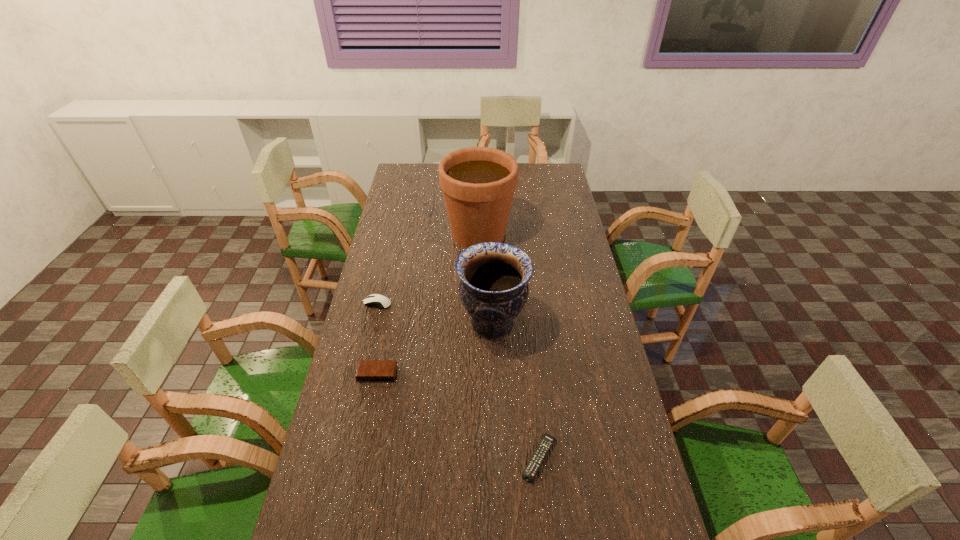
This screenshot has height=540, width=960. In order to click on flowerpot in this screenshot , I will do `click(478, 183)`.

I want to click on the farthest object, so click(478, 183).

Find the location of a particular element. Image resolution: width=960 pixels, height=540 pixels. the second tallest object is located at coordinates (493, 288).

The height and width of the screenshot is (540, 960). Identify the location of the third tallest object. (375, 300).

Where is `the fourth farthest object`? This screenshot has width=960, height=540. the fourth farthest object is located at coordinates (368, 370).

Locate an element on the screen. The height and width of the screenshot is (540, 960). the second shortest object is located at coordinates (368, 370).

Find the location of a particular element. the shortest object is located at coordinates (543, 448).

What are the coordinates of `the nearest object` in the screenshot? It's located at (543, 448).

Find the location of a particular element. vacant space located 0.290m on the right of the farthest object is located at coordinates (581, 234).

Locate an element on the screen. The width and height of the screenshot is (960, 540). vacant position located on the front handle of the fourth shortest object is located at coordinates (355, 323).